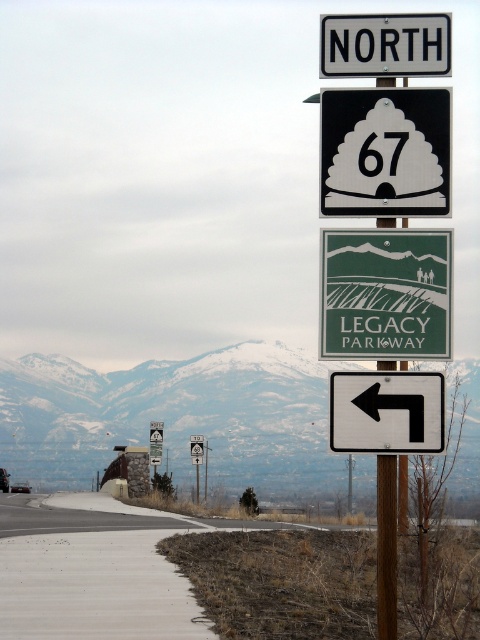
Who is positioned more to the right, white plastic road sign at upper center or white plastic sign at upper center?

white plastic road sign at upper center

From the picture: Is white plastic road sign at upper center bigger than white plastic sign at upper center?

Yes, white plastic road sign at upper center is bigger than white plastic sign at upper center.

Is point (393, 112) positioned in front of point (339, 20)?

Yes, it is.

Locate an element on the screen. The width and height of the screenshot is (480, 640). white plastic road sign at upper center is located at coordinates (384, 150).

Is snowy mountain at upper center positioned at the back of white plastic road sign at upper center?

That is False.

Consider the image. Is the position of snowy mountain at upper center less distant than that of white plastic road sign at upper center?

Yes.

This screenshot has width=480, height=640. What do you see at coordinates (175, 417) in the screenshot?
I see `snowy mountain at upper center` at bounding box center [175, 417].

You are a GUI agent. You are given a task and a screenshot of the screen. Output one action in this format:
    pyautogui.click(x=<x>, y=<y>)
    Task: Click on the snowy mountain at upper center
    
    Given the screenshot: What is the action you would take?
    pyautogui.click(x=175, y=417)

Does green matte sign at center have a smaller size compared to white plastic arrow at left?

No, green matte sign at center is not smaller than white plastic arrow at left.

Is green matte sign at center further to camera compared to white plastic arrow at left?

Yes, green matte sign at center is behind white plastic arrow at left.

Is point (420, 324) more distant than point (415, 394)?

Yes, point (420, 324) is behind point (415, 394).

This screenshot has width=480, height=640. Find the location of `green matte sign at center`. green matte sign at center is located at coordinates (385, 292).